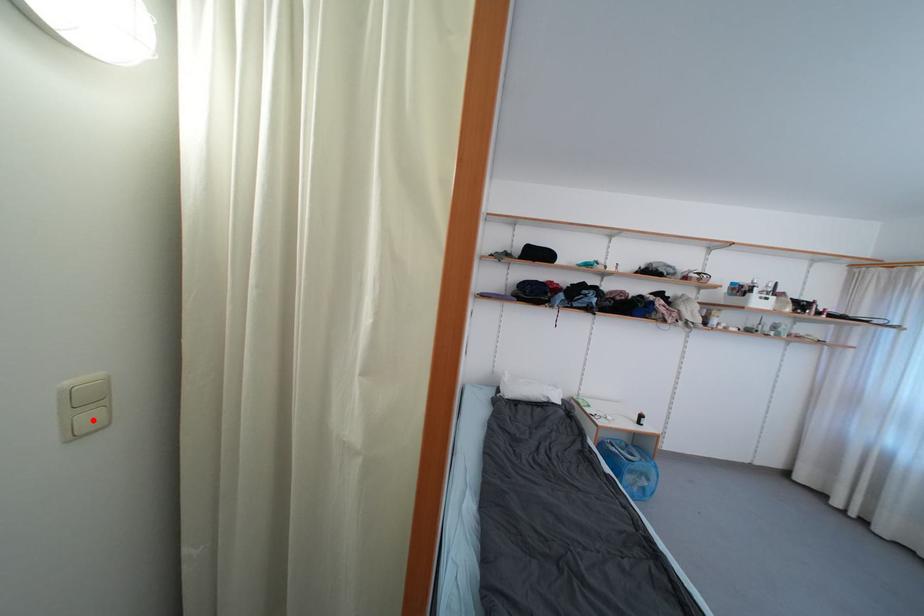
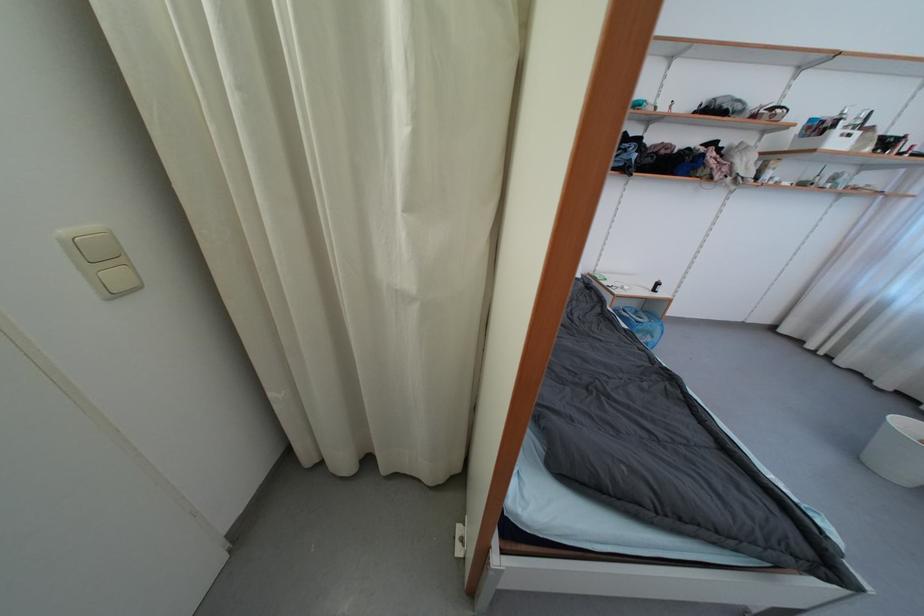
Find the pixel in the second image that matches the highlighted location in the first image.

(119, 278)